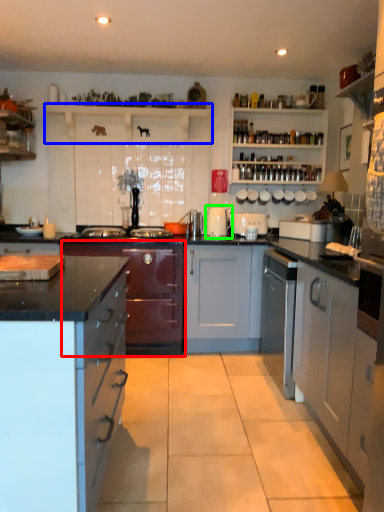
Question: Considering the real-world distances, which object is farthest from cabinetry (highlighted by a red box)? shelf (highlighted by a blue box) or appliance (highlighted by a green box)?

Choices:
 (A) shelf
 (B) appliance

Answer: (A)